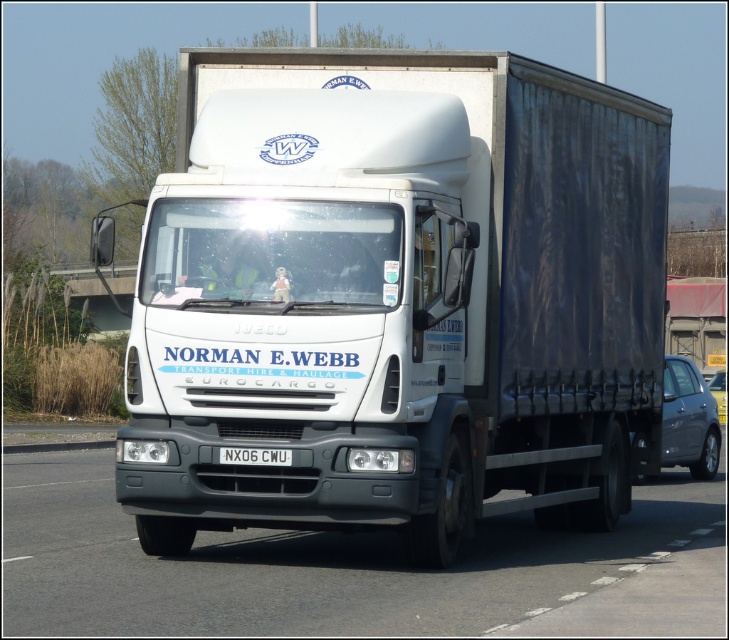
You are a parking attendant and need to park the white glossy truck at center and the metallic silver car at right in a parking lot. The parking spaces are all 2.5 meters wide. Can both vehicles fit into their respective spaces without overlapping?

The white glossy truck at center is wider than the metallic silver car at right. Since the parking spaces are 2.5 meters wide, it depends on the exact width of each vehicle. However, the description only states that the truck is wider than the car, but does not provide specific measurements. Therefore, we cannot definitively determine if both will fit without additional information.

You are a delivery driver who needs to park the white matte trailer truck at center precisely at the coordinates specified by the company. What are the coordinates where the truck should be positioned?

The white matte trailer truck at center should be positioned at coordinates point (397, 298) as specified.

You are standing 20 feet away from the truck. Is the point at coordinates point (235, 204) closer to you than your current position?

The distance of point (235, 204) from viewer is 31.88 feet, which is farther than your current position of 20 feet away from the truck. Therefore, the point is farther away from you.